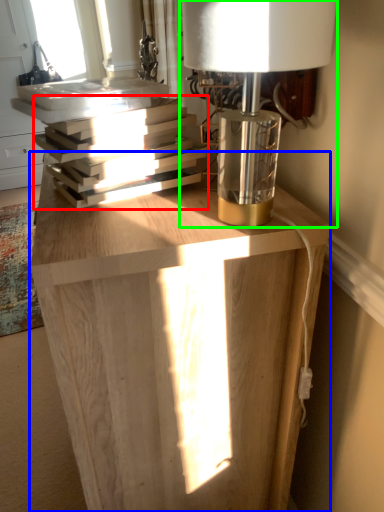
Question: Estimate the real-world distances between objects in this image. Which object is closer to book (highlighted by a red box), table (highlighted by a blue box) or lamp (highlighted by a green box)?

Choices:
 (A) table
 (B) lamp

Answer: (B)